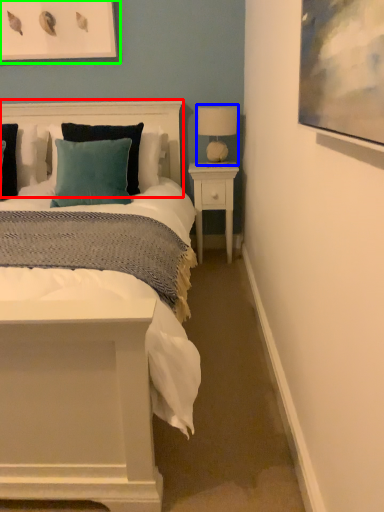
Question: Based on their relative distances, which object is farther from headboard (highlighted by a red box)? Choose from table lamp (highlighted by a blue box) and picture frame (highlighted by a green box).

Choices:
 (A) table lamp
 (B) picture frame

Answer: (A)